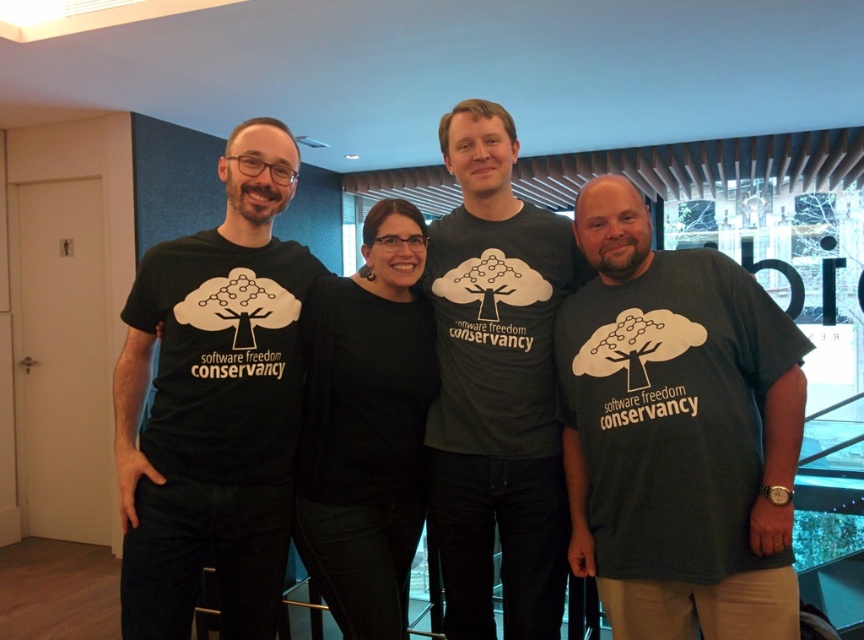
Is dark green t-shirt at right to the left of dark gray t-shirt at center from the viewer's perspective?

Incorrect, dark green t-shirt at right is not on the left side of dark gray t-shirt at center.

Does dark green t-shirt at right appear over dark gray t-shirt at center?

No.

Find the location of a particular element. dark green t-shirt at right is located at coordinates (677, 433).

Consider the image. Does matte black t-shirt at left appear on the left side of black matte shirt at center?

Correct, you'll find matte black t-shirt at left to the left of black matte shirt at center.

In the scene shown: Who is higher up, matte black t-shirt at left or black matte shirt at center?

matte black t-shirt at left is higher up.

Is point (197, 365) in front of point (402, 396)?

Yes, point (197, 365) is in front of point (402, 396).

Where is `matte black t-shirt at left`? matte black t-shirt at left is located at coordinates coord(214,403).

Is point (634, 438) behind point (239, 570)?

No.

Which is more to the left, dark green t-shirt at right or matte black t-shirt at left?

From the viewer's perspective, matte black t-shirt at left appears more on the left side.

Is point (778, 378) less distant than point (286, 164)?

Yes, it is.

Where is `dark green t-shirt at right`? This screenshot has width=864, height=640. dark green t-shirt at right is located at coordinates (677, 433).